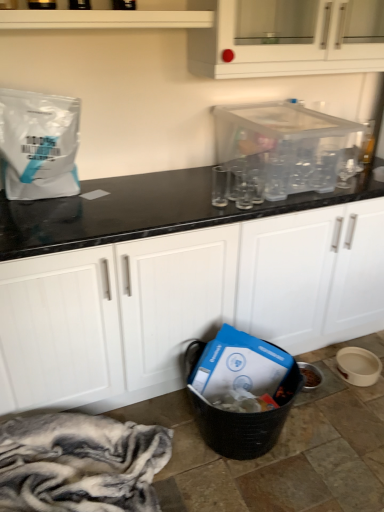
Question: From a real-world perspective, is white glossy cabinet at upper center, which appears as the 1th cabinetry when viewed from the top, positioned over white glossy shelf at upper center based on gravity?

Choices:
 (A) yes
 (B) no

Answer: (B)

Question: Can you confirm if white glossy cabinet at upper center, which appears as the 1th cabinetry when viewed from the top, is bigger than white glossy shelf at upper center?

Choices:
 (A) yes
 (B) no

Answer: (A)

Question: Is white glossy cabinet at upper center, which appears as the 1th cabinetry when viewed from the top, turned away from white glossy shelf at upper center?

Choices:
 (A) yes
 (B) no

Answer: (B)

Question: Is white glossy shelf at upper center located within white glossy cabinet at upper center, which appears as the 1th cabinetry when viewed from the top?

Choices:
 (A) yes
 (B) no

Answer: (B)

Question: From the image's perspective, does white glossy cabinet at upper center, which ranks as the second cabinetry in bottom-to-top order, appear lower than white glossy shelf at upper center?

Choices:
 (A) no
 (B) yes

Answer: (A)

Question: Based on their positions, is white matte paper bag at upper left located to the left or right of white glossy cabinet at upper center, which appears as the 1th cabinetry when viewed from the top?

Choices:
 (A) right
 (B) left

Answer: (B)

Question: Looking at their shapes, would you say white matte paper bag at upper left is wider or thinner than white glossy cabinet at upper center, which ranks as the second cabinetry in bottom-to-top order?

Choices:
 (A) thin
 (B) wide

Answer: (A)

Question: Based on their sizes in the image, would you say white matte paper bag at upper left is bigger or smaller than white glossy cabinet at upper center, which ranks as the second cabinetry in bottom-to-top order?

Choices:
 (A) big
 (B) small

Answer: (B)

Question: From a real-world perspective, is white matte paper bag at upper left above or below white glossy cabinet at upper center, which appears as the 1th cabinetry when viewed from the top?

Choices:
 (A) above
 (B) below

Answer: (B)

Question: From a real-world perspective, relative to white glossy shelf at upper center, is white matte cabinet at center, which is the 2th cabinetry in top-to-bottom order, vertically above or below?

Choices:
 (A) below
 (B) above

Answer: (A)

Question: Choose the correct answer: Is white matte cabinet at center, which is the 2th cabinetry in top-to-bottom order, inside white glossy shelf at upper center or outside it?

Choices:
 (A) outside
 (B) inside

Answer: (A)

Question: Is point (23, 365) positioned closer to the camera than point (1, 13)?

Choices:
 (A) closer
 (B) farther

Answer: (B)

Question: Considering the positions of white matte cabinet at center, the 1th cabinetry when ordered from bottom to top, and white glossy shelf at upper center in the image, is white matte cabinet at center, the 1th cabinetry when ordered from bottom to top, wider or thinner than white glossy shelf at upper center?

Choices:
 (A) thin
 (B) wide

Answer: (B)

Question: Does point (1, 272) appear closer or farther from the camera than point (380, 52)?

Choices:
 (A) closer
 (B) farther

Answer: (A)

Question: From a real-world perspective, is white matte cabinet at center, which is the 2th cabinetry in top-to-bottom order, above or below white glossy cabinet at upper center, which appears as the 1th cabinetry when viewed from the top?

Choices:
 (A) above
 (B) below

Answer: (B)